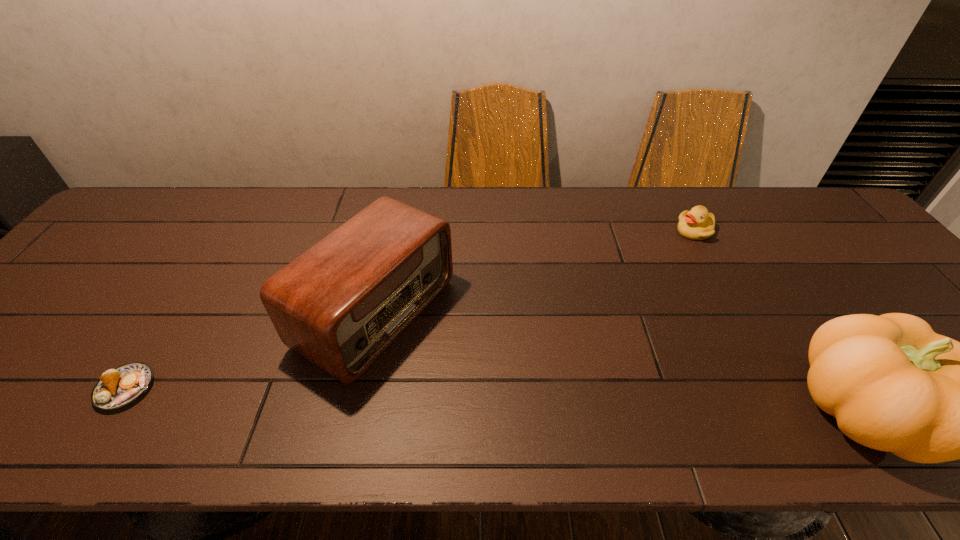
At what (x,y) coordinates should I click in order to perform the action: click on vacant area that lies between the second object from left to right and the pastry. Please return your answer as a coordinate pair (x, y). Looking at the image, I should click on (252, 350).

Where is `the third closest object to the farthest object`? The image size is (960, 540). the third closest object to the farthest object is located at coordinates (118, 387).

This screenshot has height=540, width=960. I want to click on object that can be found as the closest to the farthest object, so click(893, 384).